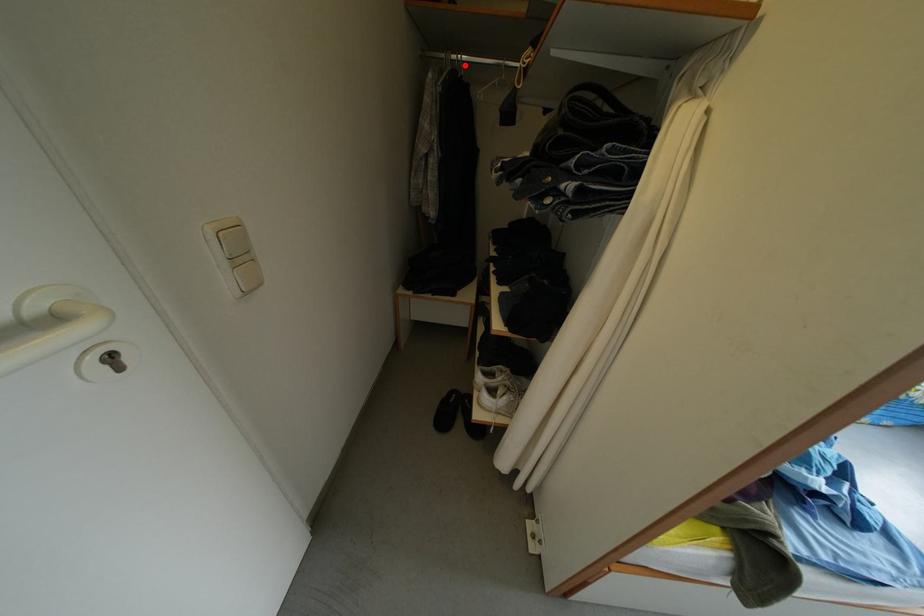
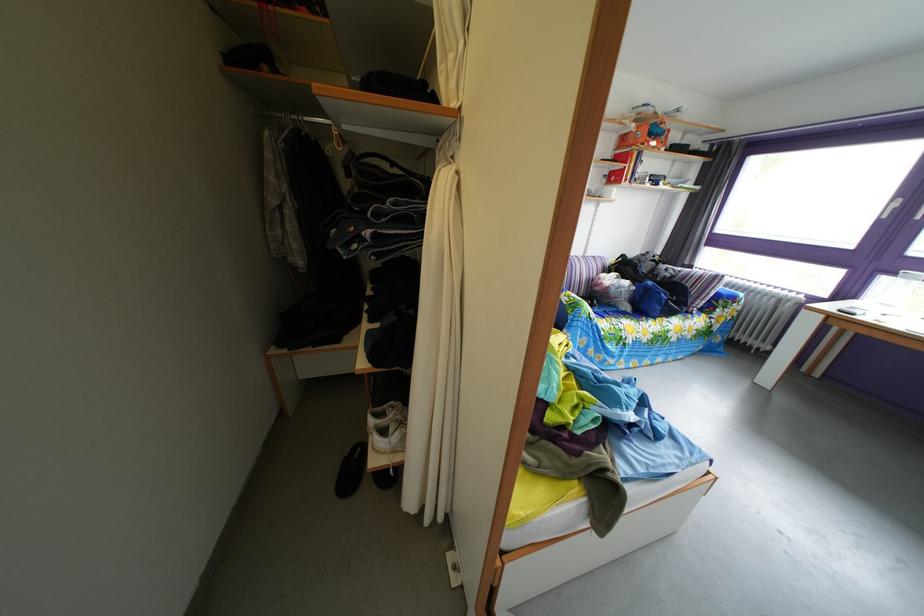
In the second image, find the point that corresponds to the highlighted location in the first image.

(306, 126)